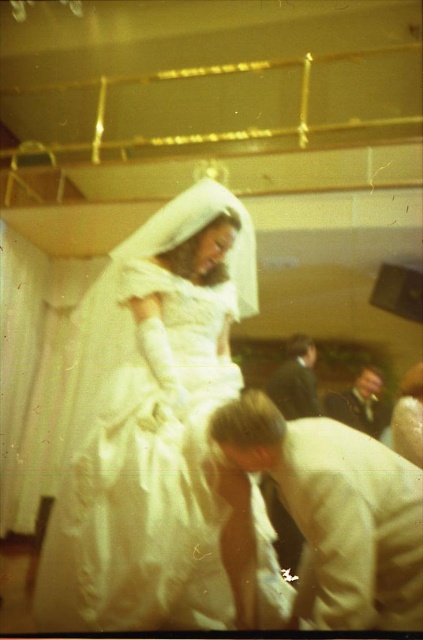
Question: Which point is farther to the camera?

Choices:
 (A) [299, 401]
 (B) [397, 579]
 (C) [186, 584]
 (D) [387, 419]

Answer: (A)

Question: Is dark suit at center above dark brown leather jacket at lower right?

Choices:
 (A) yes
 (B) no

Answer: (A)

Question: Can you confirm if white satin suit at lower center is positioned to the left of dark suit at center?

Choices:
 (A) yes
 (B) no

Answer: (B)

Question: Does white satin dress at center appear under white satin suit at lower center?

Choices:
 (A) no
 (B) yes

Answer: (A)

Question: Which object is closer to the camera taking this photo?

Choices:
 (A) dark brown leather jacket at lower right
 (B) white satin dress at center
 (C) dark suit at center
 (D) white satin suit at lower center

Answer: (D)

Question: Based on their relative distances, which object is nearer to the white satin dress at center?

Choices:
 (A) white satin suit at lower center
 (B) dark brown leather jacket at lower right

Answer: (A)